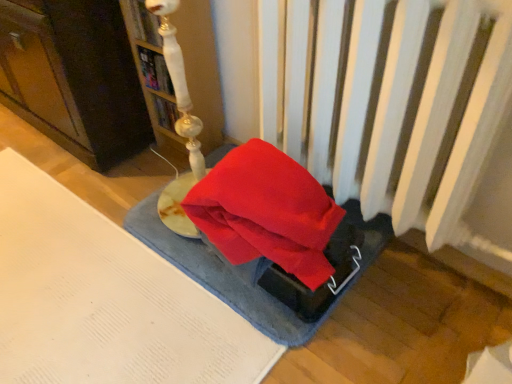
How much space does hardcover book at upper center, positioned as the 2th book in top-to-bottom order, occupy vertically?

It is 5.37 inches.

Where is `blue textured yoga mat at center`? The height and width of the screenshot is (384, 512). blue textured yoga mat at center is located at coordinates (218, 277).

Relative to white glossy lamp at upper left, acting as the 2th book starting from the bottom, is hardcover book at upper center, positioned as the 2th book in top-to-bottom order, in front or behind?

hardcover book at upper center, positioned as the 2th book in top-to-bottom order, is positioned farther from the viewer than white glossy lamp at upper left, acting as the 2th book starting from the bottom.

Based on the photo, does hardcover book at upper center, the 1th book positioned from the bottom, have a smaller size compared to white glossy lamp at upper left, acting as the 2th book starting from the bottom?

Yes, hardcover book at upper center, the 1th book positioned from the bottom, is smaller than white glossy lamp at upper left, acting as the 2th book starting from the bottom.

Is there a large distance between hardcover book at upper center, the 1th book positioned from the bottom, and white glossy lamp at upper left, acting as the 2th book starting from the bottom?

They are positioned close to each other.

Which object is more forward, blue textured yoga mat at center or hardcover book at upper center, the 1th book positioned from the bottom?

blue textured yoga mat at center.

Is hardcover book at upper center, the 1th book positioned from the bottom, at the back of blue textured yoga mat at center?

blue textured yoga mat at center does not have its back to hardcover book at upper center, the 1th book positioned from the bottom.

From the image's perspective, is blue textured yoga mat at center located above or below hardcover book at upper center, the 1th book positioned from the bottom?

blue textured yoga mat at center is below hardcover book at upper center, the 1th book positioned from the bottom.

Considering the relative sizes of hardcover book at upper center, the 1th book positioned from the bottom, and matte white lamp at upper left in the image provided, is hardcover book at upper center, the 1th book positioned from the bottom, smaller than matte white lamp at upper left?

Indeed, hardcover book at upper center, the 1th book positioned from the bottom, has a smaller size compared to matte white lamp at upper left.

How different are the orientations of hardcover book at upper center, the 1th book positioned from the bottom, and matte white lamp at upper left in degrees?

hardcover book at upper center, the 1th book positioned from the bottom, and matte white lamp at upper left are facing 1.48 degrees away from each other.

Between hardcover book at upper center, positioned as the 2th book in top-to-bottom order, and matte white lamp at upper left, which one has larger width?

Wider between the two is matte white lamp at upper left.

Can you confirm if matte white lamp at upper left is positioned to the left of hardcover book at upper center, positioned as the 2th book in top-to-bottom order?

Yes.

Is matte white lamp at upper left positioned with its back to hardcover book at upper center, positioned as the 2th book in top-to-bottom order?

No, hardcover book at upper center, positioned as the 2th book in top-to-bottom order, is not at the back of matte white lamp at upper left.

Which is behind, point (59, 63) or point (151, 76)?

Point (151, 76)

From the image's perspective, which one is positioned lower, matte white lamp at upper left or hardcover book at upper center, the 1th book positioned from the bottom?

hardcover book at upper center, the 1th book positioned from the bottom, from the image's perspective.

Based on the photo, from the image's perspective, relative to blue textured yoga mat at center, is white glossy lamp at upper left, the 1th book when ordered from top to bottom, above or below?

Clearly, from the image's perspective, white glossy lamp at upper left, the 1th book when ordered from top to bottom, is above blue textured yoga mat at center.

Is white glossy lamp at upper left, the 1th book when ordered from top to bottom, to the right of blue textured yoga mat at center from the viewer's perspective?

In fact, white glossy lamp at upper left, the 1th book when ordered from top to bottom, is to the left of blue textured yoga mat at center.

Would you say white glossy lamp at upper left, the 1th book when ordered from top to bottom, is outside blue textured yoga mat at center?

That's correct, white glossy lamp at upper left, the 1th book when ordered from top to bottom, is outside of blue textured yoga mat at center.

Can you tell me how much white glossy lamp at upper left, the 1th book when ordered from top to bottom, and blue textured yoga mat at center differ in facing direction?

The angle between the facing direction of white glossy lamp at upper left, the 1th book when ordered from top to bottom, and the facing direction of blue textured yoga mat at center is 0.00226 degrees.

Which book is the 2nd one when counting from the left side of the blue textured yoga mat at center? Please provide its 2D coordinates.

[(145, 23)]

Is blue textured yoga mat at center to the left of white glossy lamp at upper left, acting as the 2th book starting from the bottom, from the viewer's perspective?

Incorrect, blue textured yoga mat at center is not on the left side of white glossy lamp at upper left, acting as the 2th book starting from the bottom.

Considering the sizes of objects blue textured yoga mat at center and white glossy lamp at upper left, the 1th book when ordered from top to bottom, in the image provided, who is taller, blue textured yoga mat at center or white glossy lamp at upper left, the 1th book when ordered from top to bottom,?

white glossy lamp at upper left, the 1th book when ordered from top to bottom.

Who is shorter, matte white lamp at upper left or blue textured yoga mat at center?

Standing shorter between the two is blue textured yoga mat at center.

Where is `yoga mat in front of the matte white lamp at upper left`? yoga mat in front of the matte white lamp at upper left is located at coordinates (218, 277).

Which object is positioned more to the right, matte white lamp at upper left or blue textured yoga mat at center?

Positioned to the right is blue textured yoga mat at center.

Is point (35, 91) positioned behind point (158, 248)?

Yes, it is.

Locate an element on the screen. The width and height of the screenshot is (512, 384). book on the right of the white glossy lamp at upper left, the 1th book when ordered from top to bottom is located at coordinates (155, 70).

This screenshot has width=512, height=384. What are the coordinates of `yoga mat that appears in front of the hardcover book at upper center, the 1th book positioned from the bottom` in the screenshot? It's located at (218, 277).

Based on the photo, based on their spatial positions, is matte white lamp at upper left or blue textured yoga mat at center closer to hardcover book at upper center, positioned as the 2th book in top-to-bottom order?

matte white lamp at upper left lies closer to hardcover book at upper center, positioned as the 2th book in top-to-bottom order, than the other object.

When comparing their distances from hardcover book at upper center, positioned as the 2th book in top-to-bottom order, does blue textured yoga mat at center or white glossy lamp at upper left, acting as the 2th book starting from the bottom, seem further?

blue textured yoga mat at center lies further to hardcover book at upper center, positioned as the 2th book in top-to-bottom order, than the other object.

When comparing their distances from white glossy lamp at upper left, the 1th book when ordered from top to bottom, does blue textured yoga mat at center or matte white lamp at upper left seem closer?

matte white lamp at upper left lies closer to white glossy lamp at upper left, the 1th book when ordered from top to bottom, than the other object.

When comparing their distances from blue textured yoga mat at center, does hardcover book at upper center, positioned as the 2th book in top-to-bottom order, or white glossy lamp at upper left, acting as the 2th book starting from the bottom, seem closer?

hardcover book at upper center, positioned as the 2th book in top-to-bottom order, is positioned closer to the anchor blue textured yoga mat at center.

Considering their positions, is white glossy lamp at upper left, the 1th book when ordered from top to bottom, positioned further to blue textured yoga mat at center than hardcover book at upper center, the 1th book positioned from the bottom?

white glossy lamp at upper left, the 1th book when ordered from top to bottom, is further to blue textured yoga mat at center.

Estimate the real-world distances between objects in this image. Which object is closer to matte white lamp at upper left, hardcover book at upper center, the 1th book positioned from the bottom, or blue textured yoga mat at center?

Among the two, hardcover book at upper center, the 1th book positioned from the bottom, is located nearer to matte white lamp at upper left.

Estimate the real-world distances between objects in this image. Which object is closer to white glossy lamp at upper left, acting as the 2th book starting from the bottom, hardcover book at upper center, positioned as the 2th book in top-to-bottom order, or matte white lamp at upper left?

The object closer to white glossy lamp at upper left, acting as the 2th book starting from the bottom, is hardcover book at upper center, positioned as the 2th book in top-to-bottom order.

From the image, which object appears to be farther from blue textured yoga mat at center, matte white lamp at upper left or white glossy lamp at upper left, acting as the 2th book starting from the bottom?

white glossy lamp at upper left, acting as the 2th book starting from the bottom, lies further to blue textured yoga mat at center than the other object.

Locate an element on the screen. The height and width of the screenshot is (384, 512). book between white glossy lamp at upper left, acting as the 2th book starting from the bottom, and blue textured yoga mat at center vertically is located at coordinates (155, 70).

What are the coordinates of `book between matte white lamp at upper left and hardcover book at upper center, positioned as the 2th book in top-to-bottom order` in the screenshot? It's located at (145, 23).